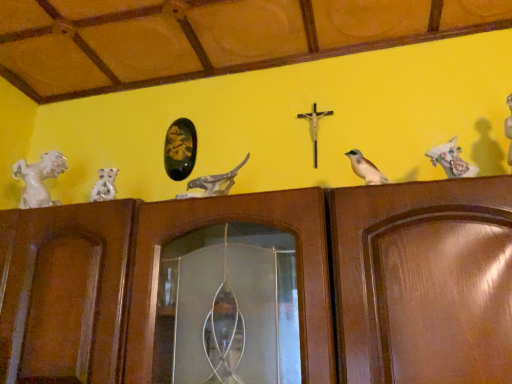
Question: Is white glossy horse at left, arranged as the first animal when viewed from the left, next to matte gray stone bird at center, which is the 3th animal from left to right?

Choices:
 (A) no
 (B) yes

Answer: (A)

Question: Is white glossy horse at left, which is the fourth animal from right to left, looking in the opposite direction of matte gray stone bird at center, which is the 3th animal from left to right?

Choices:
 (A) yes
 (B) no

Answer: (B)

Question: Could you tell me if white glossy horse at left, arranged as the first animal when viewed from the left, is turned towards matte gray stone bird at center, which is the 3th animal from left to right?

Choices:
 (A) no
 (B) yes

Answer: (A)

Question: Considering the relative sizes of white glossy horse at left, arranged as the first animal when viewed from the left, and matte gray stone bird at center, which is the 3th animal from left to right, in the image provided, is white glossy horse at left, arranged as the first animal when viewed from the left, bigger than matte gray stone bird at center, which is the 3th animal from left to right,?

Choices:
 (A) no
 (B) yes

Answer: (A)

Question: From the image's perspective, is white glossy horse at left, arranged as the first animal when viewed from the left, located beneath matte gray stone bird at center, which is the 3th animal from left to right?

Choices:
 (A) yes
 (B) no

Answer: (A)

Question: From the image's perspective, relative to white glossy horse at left, which is the fourth animal from right to left, is metallic gold crucifix at center above or below?

Choices:
 (A) below
 (B) above

Answer: (B)

Question: Does point (314, 155) appear closer or farther from the camera than point (15, 172)?

Choices:
 (A) farther
 (B) closer

Answer: (B)

Question: Is metallic gold crucifix at center bigger or smaller than white glossy horse at left, arranged as the first animal when viewed from the left?

Choices:
 (A) small
 (B) big

Answer: (A)

Question: Considering the positions of metallic gold crucifix at center and white glossy horse at left, which is the fourth animal from right to left, in the image, is metallic gold crucifix at center wider or thinner than white glossy horse at left, which is the fourth animal from right to left,?

Choices:
 (A) wide
 (B) thin

Answer: (B)

Question: From a real-world perspective, is white glossy horse at left, arranged as the first animal when viewed from the left, positioned above or below brown wood door at center?

Choices:
 (A) above
 (B) below

Answer: (A)

Question: Considering their positions, is white glossy horse at left, which is the fourth animal from right to left, located in front of or behind brown wood door at center?

Choices:
 (A) front
 (B) behind

Answer: (B)

Question: In terms of size, does white glossy horse at left, which is the fourth animal from right to left, appear bigger or smaller than brown wood door at center?

Choices:
 (A) big
 (B) small

Answer: (B)

Question: Is point (32, 177) closer or farther from the camera than point (91, 367)?

Choices:
 (A) farther
 (B) closer

Answer: (A)

Question: Is metallic gold crucifix at center bigger or smaller than brown wood door at center?

Choices:
 (A) small
 (B) big

Answer: (A)

Question: Is point (316, 162) positioned closer to the camera than point (98, 228)?

Choices:
 (A) closer
 (B) farther

Answer: (B)